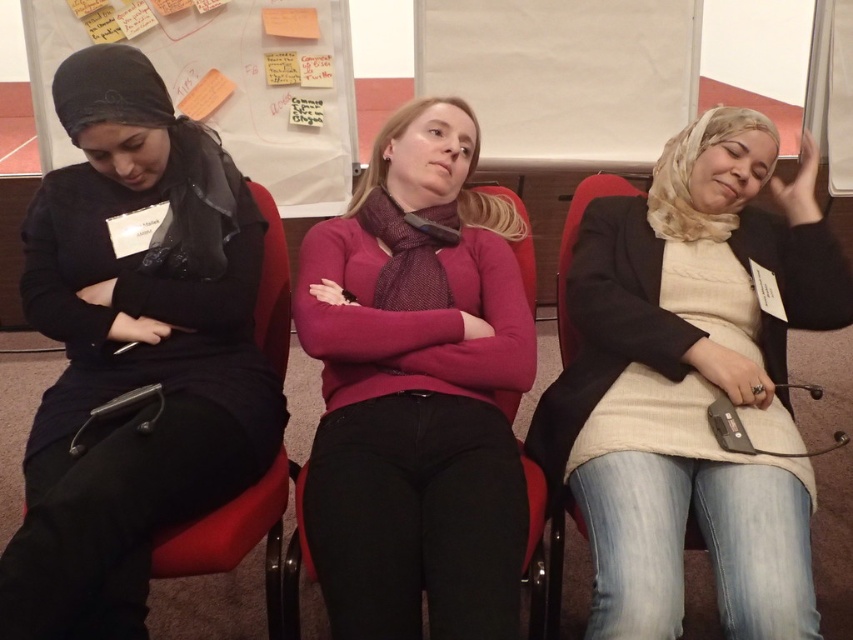
Between light beige sweater at center and white paperboard at upper center, which one has less height?

Standing shorter between the two is white paperboard at upper center.

Who is higher up, light beige sweater at center or white paperboard at upper center?

white paperboard at upper center is higher up.

What do you see at coordinates (699, 381) in the screenshot?
I see `light beige sweater at center` at bounding box center [699, 381].

I want to click on light beige sweater at center, so click(x=699, y=381).

Can you confirm if light beige sweater at center is smaller than matte pink sweater at center?

Incorrect, light beige sweater at center is not smaller in size than matte pink sweater at center.

This screenshot has height=640, width=853. I want to click on light beige sweater at center, so click(699, 381).

Does matte pink sweater at center have a greater width compared to white paperboard at upper center?

Incorrect, matte pink sweater at center's width does not surpass white paperboard at upper center's.

Who is lower down, matte pink sweater at center or white paperboard at upper center?

matte pink sweater at center is below.

Where is `matte pink sweater at center`? The height and width of the screenshot is (640, 853). matte pink sweater at center is located at coordinates (416, 392).

This screenshot has height=640, width=853. Find the location of `matte pink sweater at center`. matte pink sweater at center is located at coordinates (416, 392).